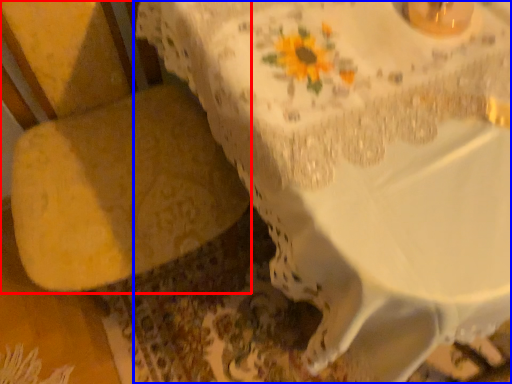
Question: Which object appears closest to the camera in this image, armchair (highlighted by a red box) or table (highlighted by a blue box)?

Choices:
 (A) armchair
 (B) table

Answer: (A)